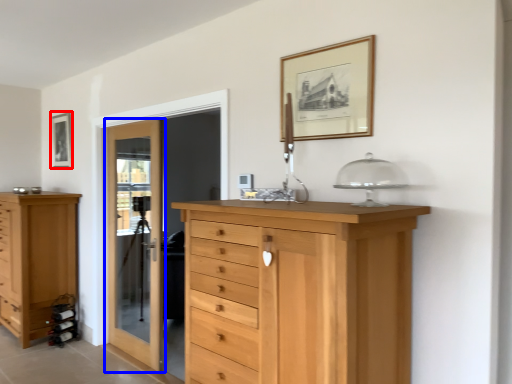
Question: Which of the following is the farthest to the observer, picture frame (highlighted by a red box) or door (highlighted by a blue box)?

Choices:
 (A) picture frame
 (B) door

Answer: (A)